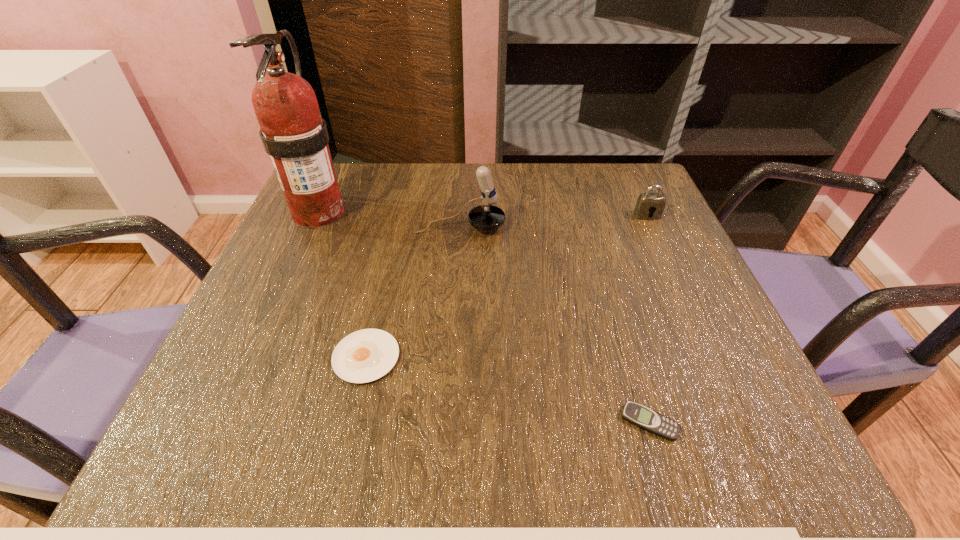
The width and height of the screenshot is (960, 540). In order to click on vacant space located 0.140m at the front of the rightmost object near the keyhole in this screenshot , I will do `click(668, 262)`.

The height and width of the screenshot is (540, 960). What are the coordinates of `vacant region located 0.140m on the left of the fourth farthest object` in the screenshot? It's located at click(x=248, y=357).

The height and width of the screenshot is (540, 960). I want to click on vacant space located on the back of the beeper, so [x=595, y=240].

You are a GUI agent. You are given a task and a screenshot of the screen. Output one action in this format:
    pyautogui.click(x=<x>, y=<y>)
    Task: Click on the fire extinguisher that is at the far edge
    The width and height of the screenshot is (960, 540).
    Given the screenshot: What is the action you would take?
    pyautogui.click(x=293, y=133)

Where is `microphone present at the far edge`? microphone present at the far edge is located at coordinates (486, 217).

The height and width of the screenshot is (540, 960). Find the location of `padlock that is at the far edge`. padlock that is at the far edge is located at coordinates (647, 203).

The width and height of the screenshot is (960, 540). Find the location of `object positioned at the near edge`. object positioned at the near edge is located at coordinates (645, 418).

Find the location of a particular element. object that is at the left edge is located at coordinates (293, 133).

Find the location of a particular element. padlock that is at the right edge is located at coordinates (647, 203).

Locate an element on the screen. beeper located in the right edge section of the desktop is located at coordinates (645, 418).